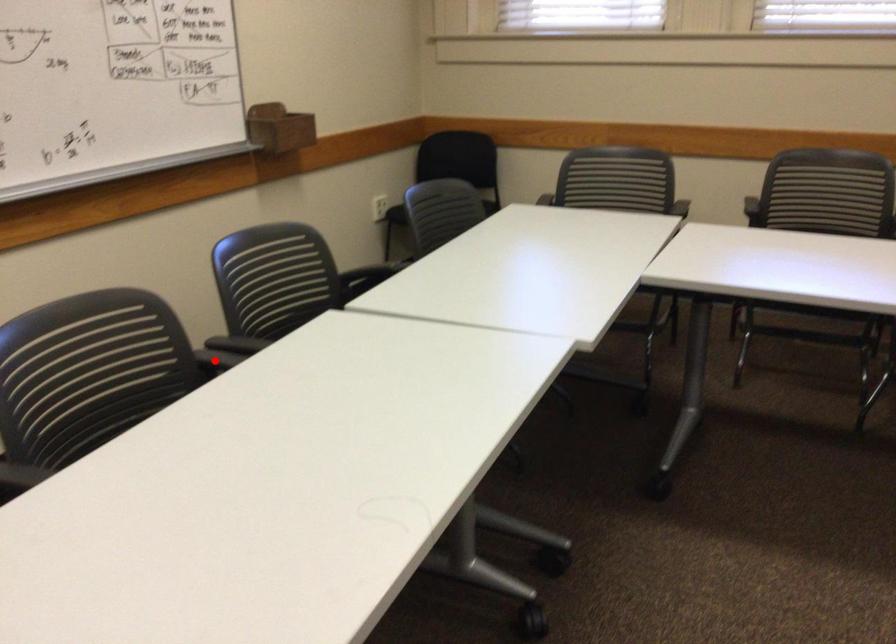
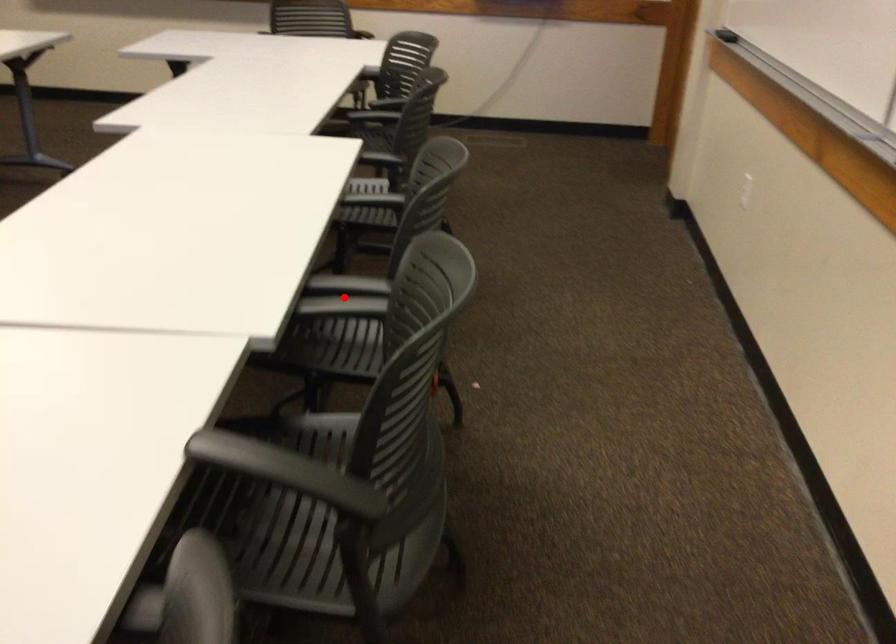
I am providing you with two images of the same scene from different viewpoints. A red point is marked on the first image and another point is marked on the second image. Is the marked point in image1 the same physical position as the marked point in image2?

Yes